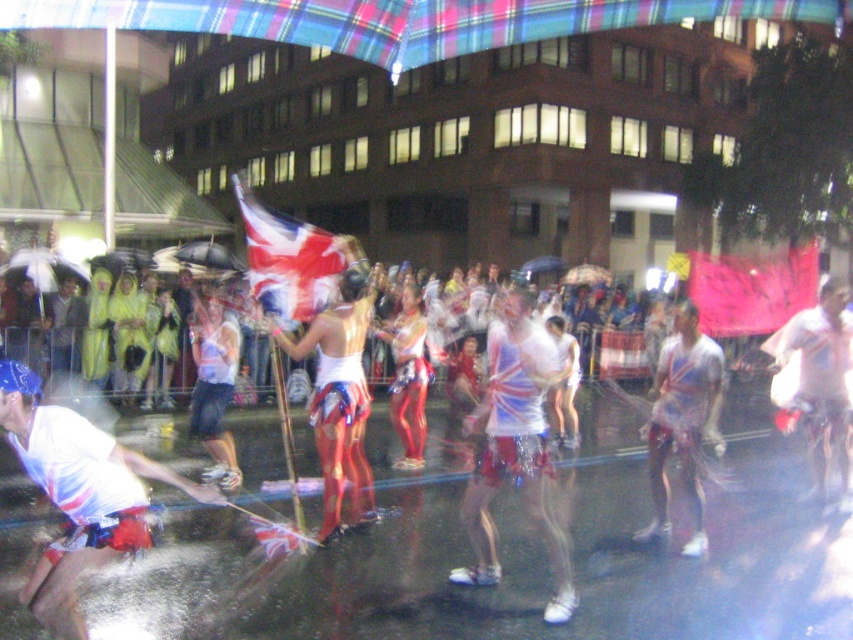
Can you confirm if shiny metallic shorts at center is thinner than white glossy shirt at right?

Correct, shiny metallic shorts at center's width is less than white glossy shirt at right's.

Who is higher up, shiny metallic shorts at center or white glossy shirt at right?

white glossy shirt at right

Describe the element at coordinates (517, 449) in the screenshot. I see `shiny metallic shorts at center` at that location.

Find the location of a particular element. This screenshot has width=853, height=640. shiny metallic shorts at center is located at coordinates (517, 449).

Does shiny metallic shorts at center appear under white glossy shirt at center?

Yes.

Does shiny metallic shorts at center lie in front of white glossy shirt at center?

Yes, shiny metallic shorts at center is closer to the viewer.

Who is more forward, (x=550, y=369) or (x=695, y=500)?

Positioned in front is point (x=550, y=369).

The width and height of the screenshot is (853, 640). I want to click on shiny metallic shorts at center, so click(x=517, y=449).

Does white glossy shirt at lower left have a greater height compared to shiny metallic shorts at center?

No, white glossy shirt at lower left is not taller than shiny metallic shorts at center.

Between point (109, 509) and point (544, 330), which one is positioned behind?

Point (544, 330)

Where is `white glossy shirt at lower left`? This screenshot has height=640, width=853. white glossy shirt at lower left is located at coordinates (79, 493).